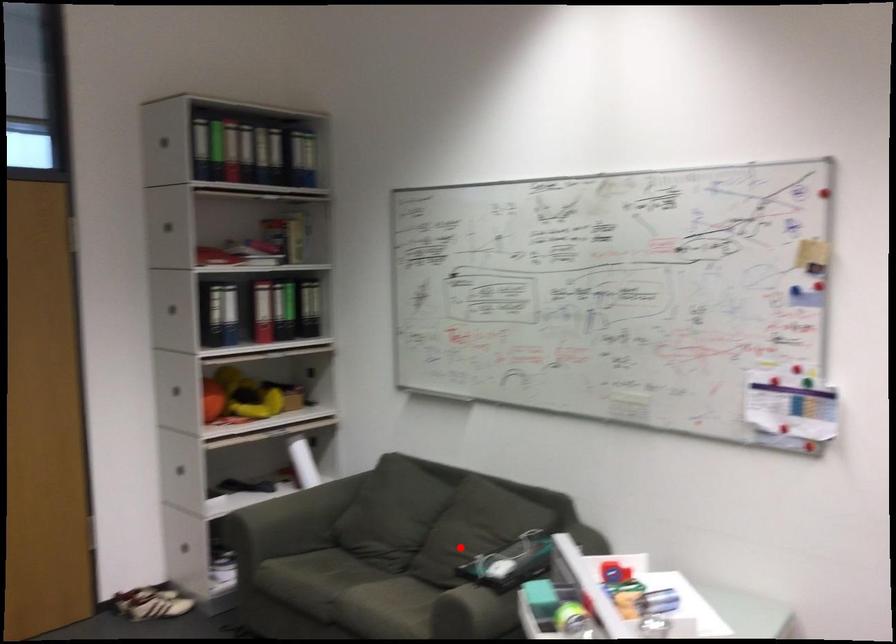
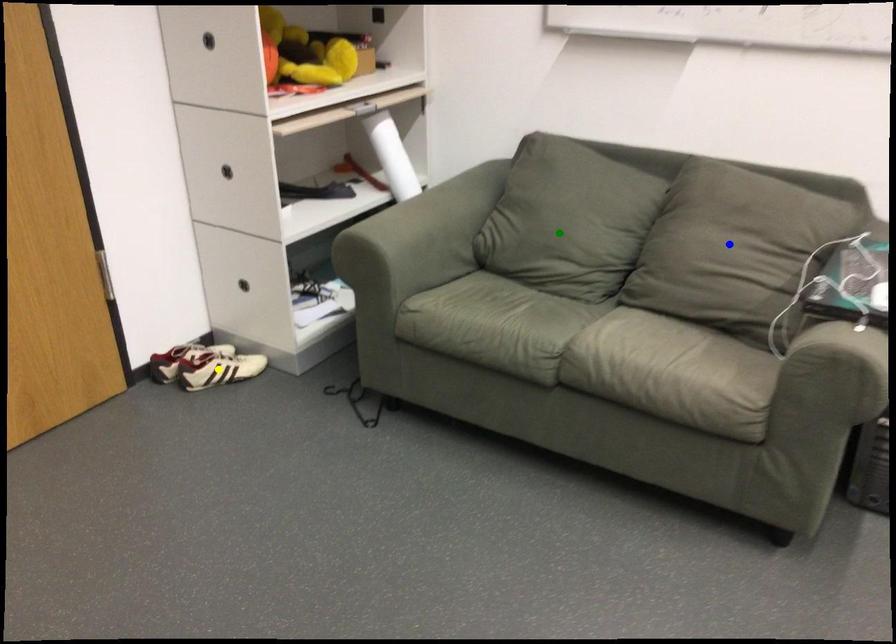
Question: I am providing you with two images of the same scene from different viewpoints. A red point is marked on the first image. You are given multiple points on the second image. Which mark in image 2 goes with the point in image 1?

Choices:
 (A) green point
 (B) blue point
 (C) yellow point

Answer: (B)